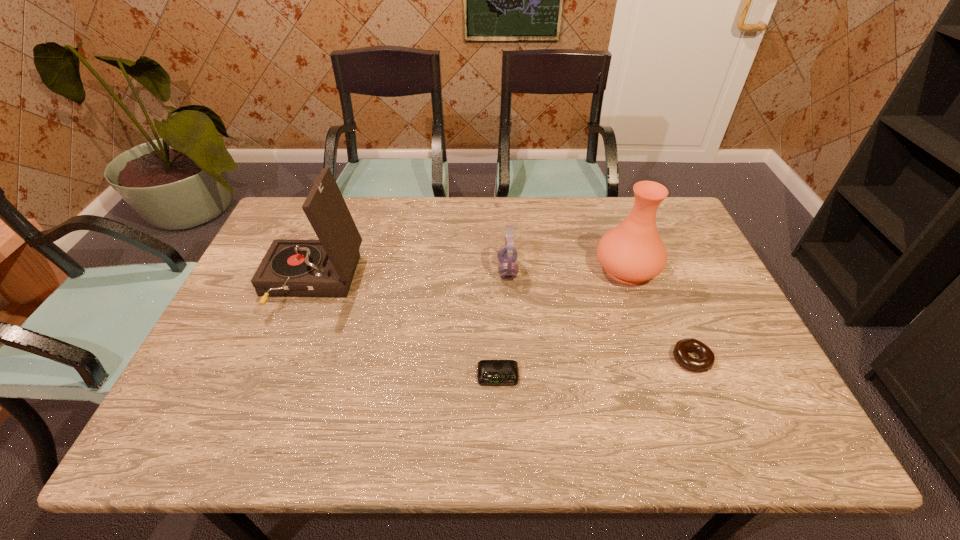
Identify the location of free space at the near right corner of the desktop. pos(759,416).

I want to click on vacant area that lies between the headset and the fourth tallest object, so click(599, 315).

Where is `free point between the leftmost object and the vase`? This screenshot has width=960, height=540. free point between the leftmost object and the vase is located at coordinates (468, 276).

Identify the location of free spot between the third tallest object and the leftmost object. The height and width of the screenshot is (540, 960). (409, 277).

In order to click on blank region between the leftmost object and the doughnut in this screenshot , I will do `click(501, 322)`.

This screenshot has width=960, height=540. In order to click on vacant area between the third shortest object and the vase in this screenshot , I will do `click(567, 269)`.

The width and height of the screenshot is (960, 540). What are the coordinates of `free area in between the phonograph record and the vase` in the screenshot? It's located at (468, 276).

Locate an element on the screen. The width and height of the screenshot is (960, 540). unoccupied area between the fourth tallest object and the leftmost object is located at coordinates (501, 322).

The height and width of the screenshot is (540, 960). I want to click on free space between the doughnut and the vase, so click(x=659, y=314).

Where is `blank region between the third tallest object and the shortest object`? The width and height of the screenshot is (960, 540). blank region between the third tallest object and the shortest object is located at coordinates (503, 323).